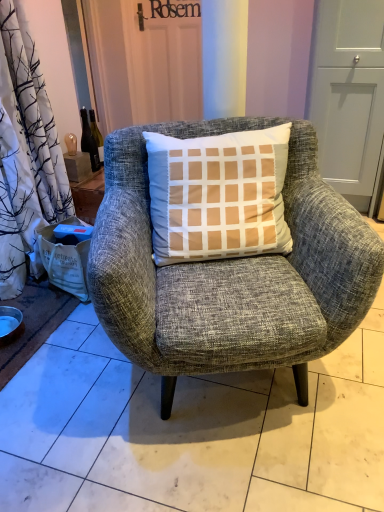
Question: Is white paper bag at lower left wider or thinner than translucent glass bottle at upper left?

Choices:
 (A) wide
 (B) thin

Answer: (A)

Question: In the image, is white paper bag at lower left positioned in front of or behind translucent glass bottle at upper left?

Choices:
 (A) behind
 (B) front

Answer: (B)

Question: Which of these objects is positioned closest to the white paper bag at lower left?

Choices:
 (A) matte gray screen door at upper right
 (B) textured gray armchair at center
 (C) translucent glass bottle at upper left
 (D) matte silver bowl at lower left

Answer: (D)

Question: Estimate the real-world distances between objects in this image. Which object is closer to the textured gray armchair at center?

Choices:
 (A) matte silver bowl at lower left
 (B) matte gray screen door at upper right
 (C) white paper bag at lower left
 (D) translucent glass bottle at upper left

Answer: (C)